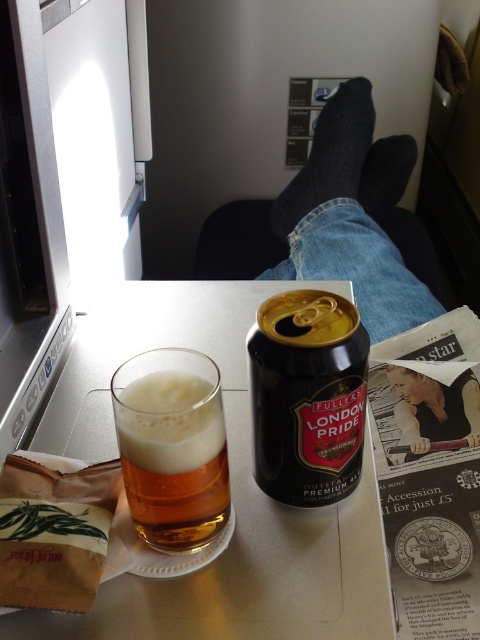
Between translucent plastic tray at center and smooth skin at upper center, which one is positioned higher?

translucent plastic tray at center is higher up.

Can you confirm if translucent plastic tray at center is positioned to the left of smooth skin at upper center?

Indeed, translucent plastic tray at center is positioned on the left side of smooth skin at upper center.

This screenshot has width=480, height=640. I want to click on translucent plastic tray at center, so click(230, 492).

Image resolution: width=480 pixels, height=640 pixels. Find the location of `translucent plastic tray at center`. translucent plastic tray at center is located at coordinates (230, 492).

Find the location of a particular element. translucent plastic tray at center is located at coordinates (230, 492).

Is translucent plastic tray at center further to camera compared to black matte can at center?

No, it is in front of black matte can at center.

Does translucent plastic tray at center appear over black matte can at center?

Incorrect, translucent plastic tray at center is not positioned above black matte can at center.

The height and width of the screenshot is (640, 480). In order to click on translucent plastic tray at center in this screenshot , I will do `click(230, 492)`.